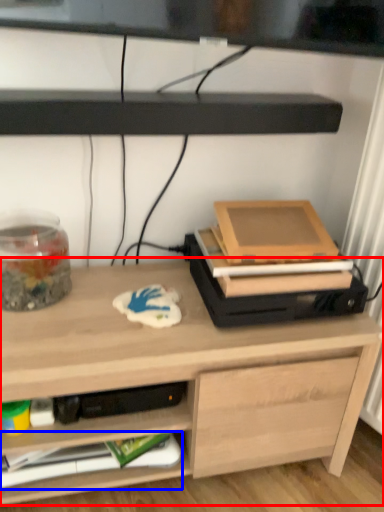
Question: Which of the following is the closest to the observer, desk (highlighted by a red box) or paperback book (highlighted by a blue box)?

Choices:
 (A) desk
 (B) paperback book

Answer: (A)